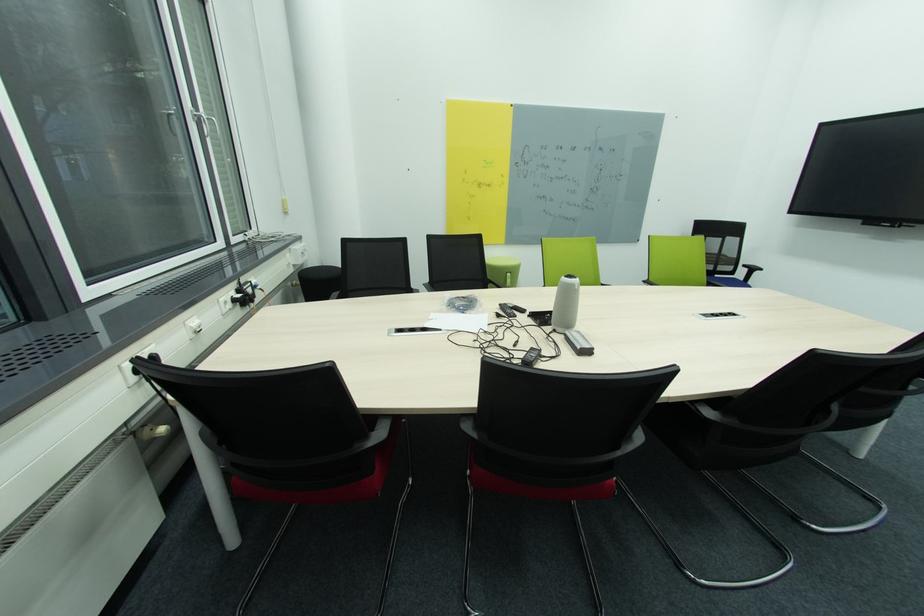
Which object does [565,304] point to?

This point indicates the grey conference speaker.